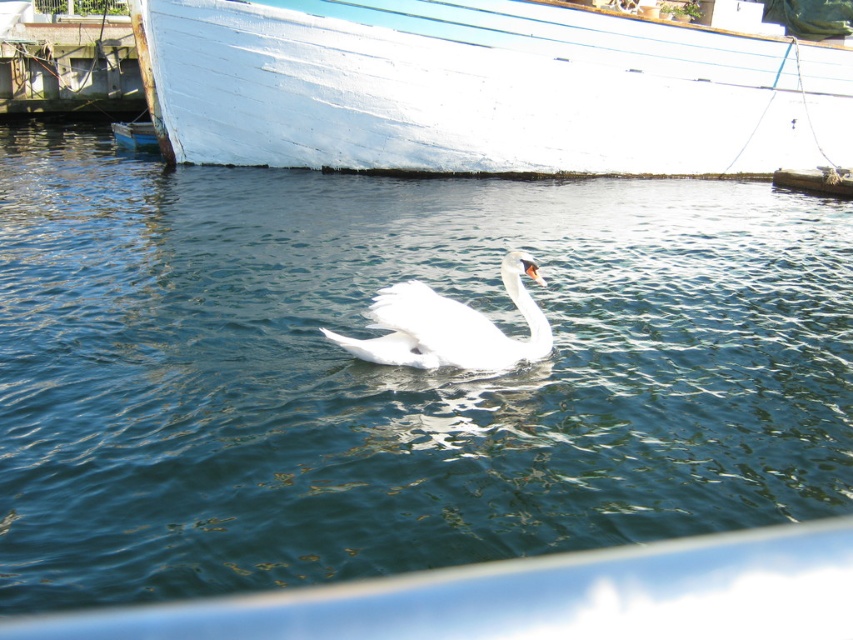
Question: Which point is farther to the camera?

Choices:
 (A) (374, 304)
 (B) (334, 104)

Answer: (B)

Question: Is white matte boat at upper center wider than white feathered swan at center?

Choices:
 (A) no
 (B) yes

Answer: (B)

Question: Does white matte boat at upper center have a lesser width compared to white feathered swan at center?

Choices:
 (A) yes
 (B) no

Answer: (B)

Question: Which of the following is the farthest from the observer?

Choices:
 (A) (440, 352)
 (B) (401, 125)

Answer: (B)

Question: Does white matte boat at upper center appear over white feathered swan at center?

Choices:
 (A) yes
 (B) no

Answer: (A)